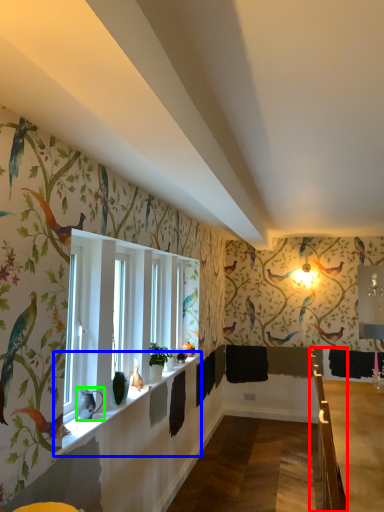
Question: Which object is positioned closest to rail (highlighted by a red box)? Select from window sill (highlighted by a blue box) and animal (highlighted by a green box).

Choices:
 (A) window sill
 (B) animal

Answer: (A)